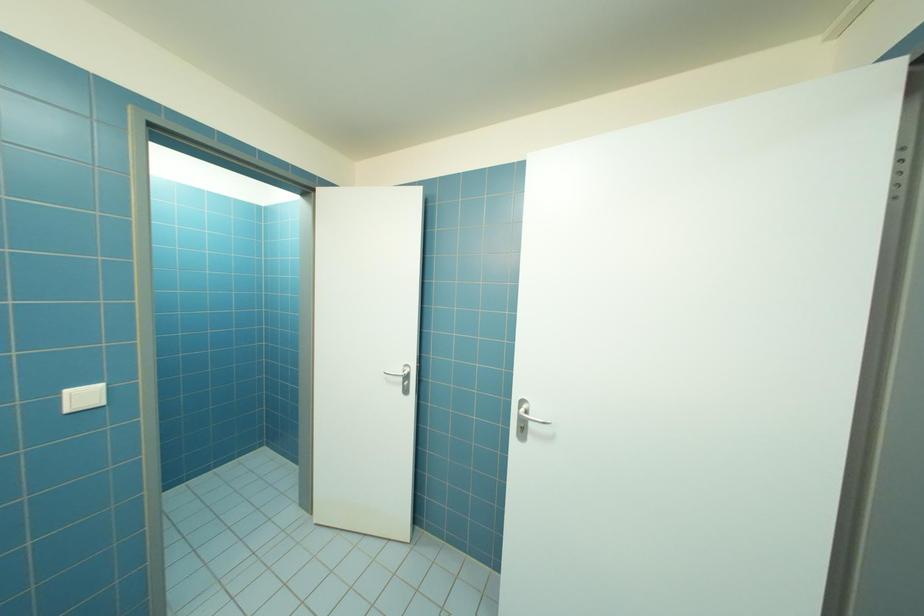
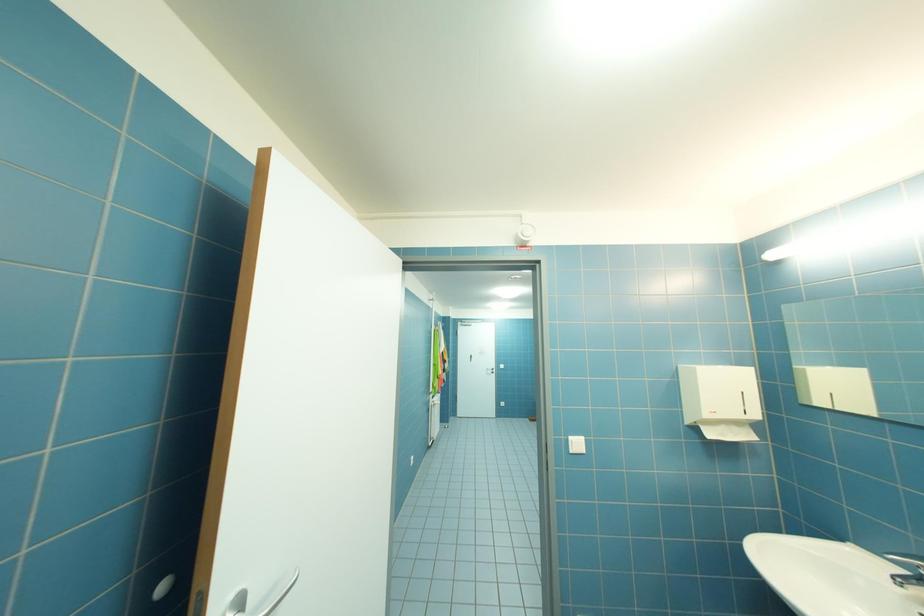
Question: Based on the continuous images, in which direction is the camera rotating? Reply with the corresponding letter.

Choices:
 (A) Left
 (B) Right
 (C) Up
 (D) Down

Answer: (B)